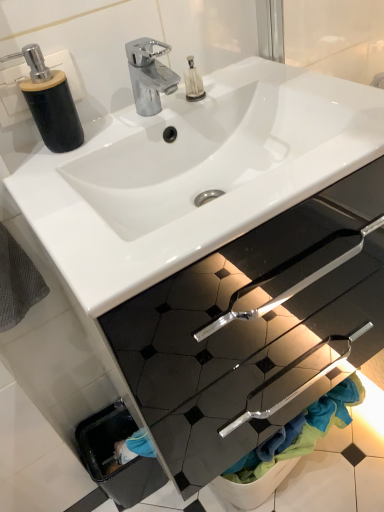
Image resolution: width=384 pixels, height=512 pixels. Find the location of `vacant point to the right of matte black soap dispenser at upper left`. vacant point to the right of matte black soap dispenser at upper left is located at coordinates (125, 127).